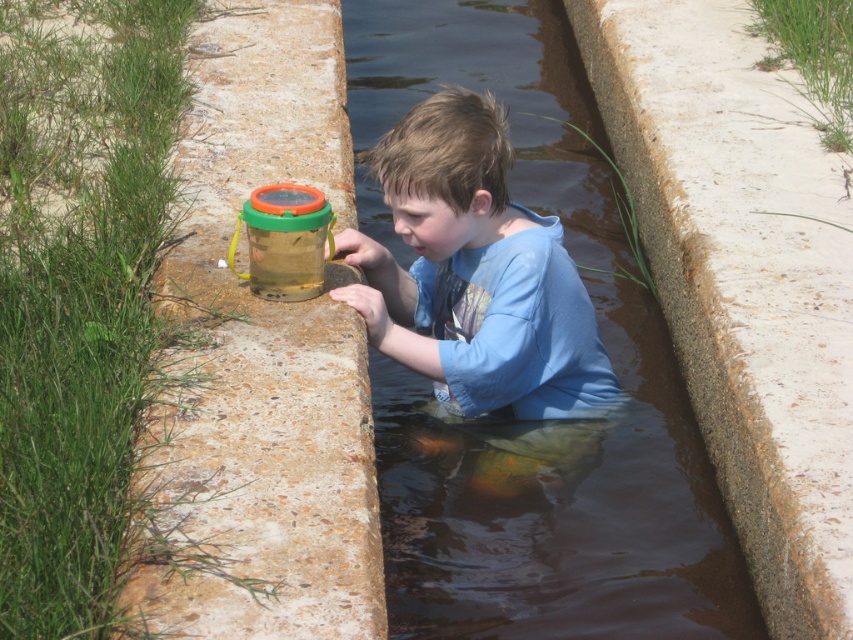
Question: Is rusty concrete at center to the left of blue cotton shirt at center from the viewer's perspective?

Choices:
 (A) no
 (B) yes

Answer: (A)

Question: Is rusty concrete ledge at left closer to the viewer compared to blue cotton shirt at center?

Choices:
 (A) no
 (B) yes

Answer: (B)

Question: Among these objects, which one is nearest to the camera?

Choices:
 (A) rusty concrete ledge at left
 (B) blue cotton shirt at center

Answer: (A)

Question: Does rusty concrete ledge at left appear under blue cotton shirt at center?

Choices:
 (A) yes
 (B) no

Answer: (B)

Question: Which of the following is the closest to the observer?

Choices:
 (A) rusty concrete ledge at left
 (B) rusty concrete at center
 (C) blue cotton shirt at center

Answer: (A)

Question: Estimate the real-world distances between objects in this image. Which object is closer to the rusty concrete ledge at left?

Choices:
 (A) blue cotton shirt at center
 (B) rusty concrete at center

Answer: (A)